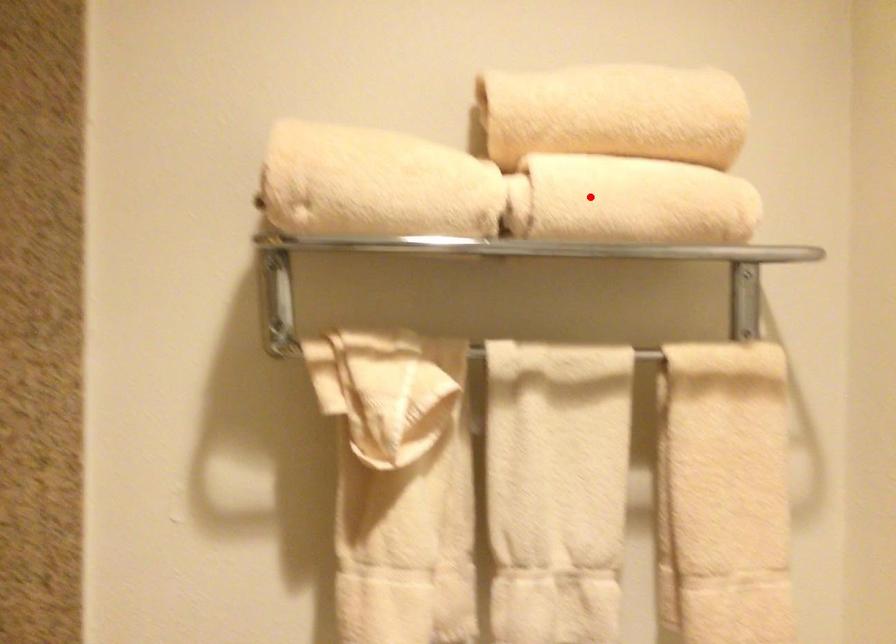
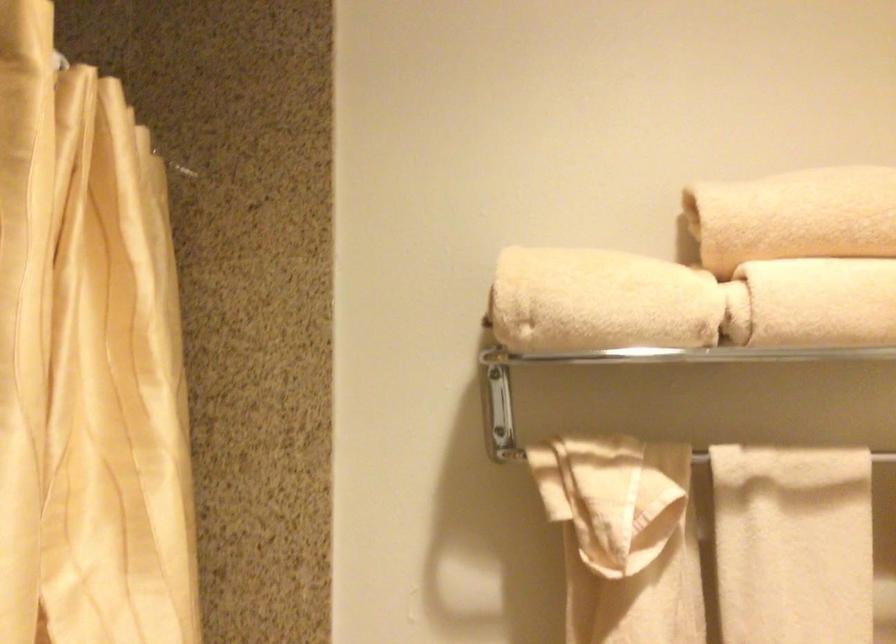
The point at the highlighted location is marked in the first image. Where is the corresponding point in the second image?

(814, 301)